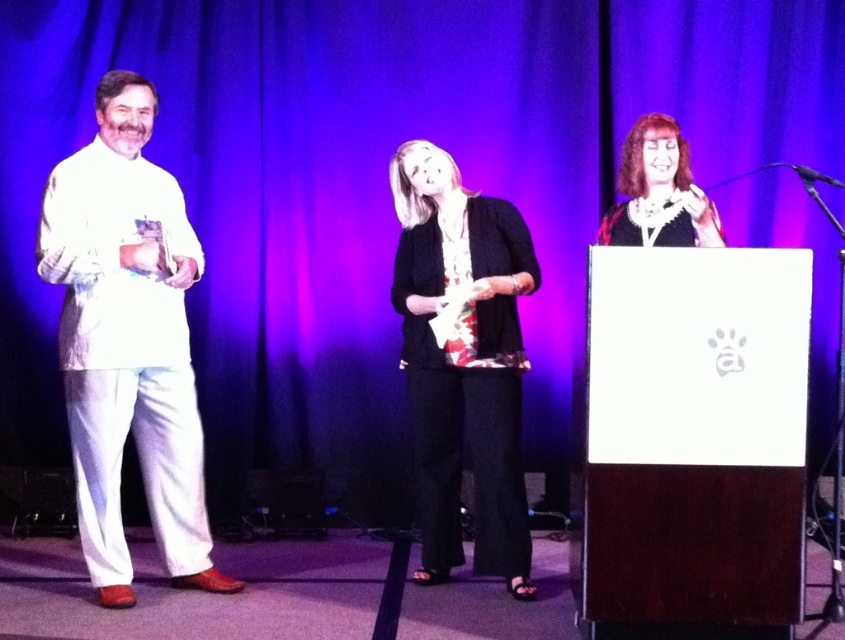
Question: Based on their relative distances, which object is farther from the black textured pants at center?

Choices:
 (A) white satin suit at left
 (B) matte black dress at center

Answer: (A)

Question: Is white satin suit at left to the left of matte black dress at center from the viewer's perspective?

Choices:
 (A) yes
 (B) no

Answer: (A)

Question: Can you confirm if white satin suit at left is wider than matte black dress at center?

Choices:
 (A) no
 (B) yes

Answer: (B)

Question: Does white satin suit at left have a larger size compared to black textured pants at center?

Choices:
 (A) yes
 (B) no

Answer: (A)

Question: Which point is farther to the camera?

Choices:
 (A) (674, 132)
 (B) (439, 400)

Answer: (B)

Question: Estimate the real-world distances between objects in this image. Which object is farther from the matte black dress at center?

Choices:
 (A) white satin suit at left
 (B) black textured pants at center

Answer: (A)